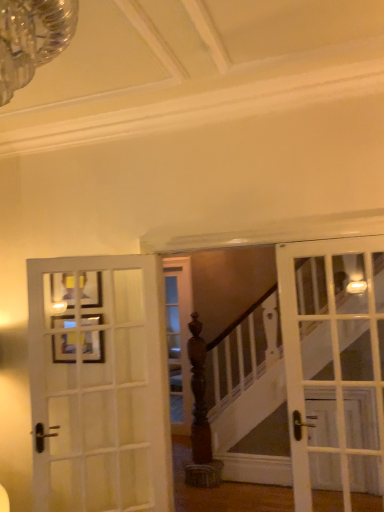
At what (x,y) coordinates should I click in order to perform the action: click on vacant region above white glass door at right, the 2th door when ordered from left to right (from a real-world perspective). Please return your answer as a coordinate pair (x, y). Looking at the image, I should click on (324, 239).